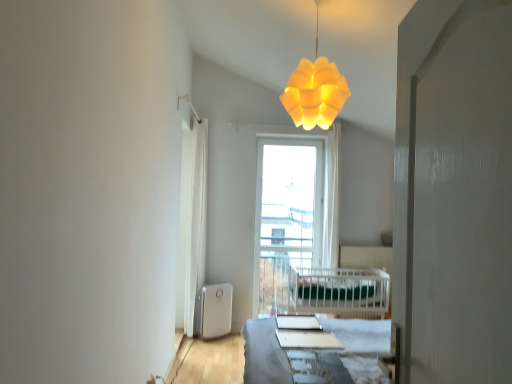
Question: In terms of height, does white glossy table at center look taller or shorter compared to white glossy screen door at right?

Choices:
 (A) short
 (B) tall

Answer: (A)

Question: Is white glossy table at center to the left or to the right of white glossy screen door at right in the image?

Choices:
 (A) left
 (B) right

Answer: (A)

Question: Which object is positioned farthest from the yellow matte lampshade at upper center?

Choices:
 (A) white plastic water heater at lower left
 (B) white fabric curtain at left
 (C) white glossy screen door at right
 (D) transparent glass window at center
 (E) white glossy table at center

Answer: (A)

Question: Which object is positioned farthest from the yellow matte lampshade at upper center?

Choices:
 (A) white glossy table at center
 (B) white glossy screen door at right
 (C) white plastic water heater at lower left
 (D) white fabric curtain at left
 (E) transparent glass window at center

Answer: (C)